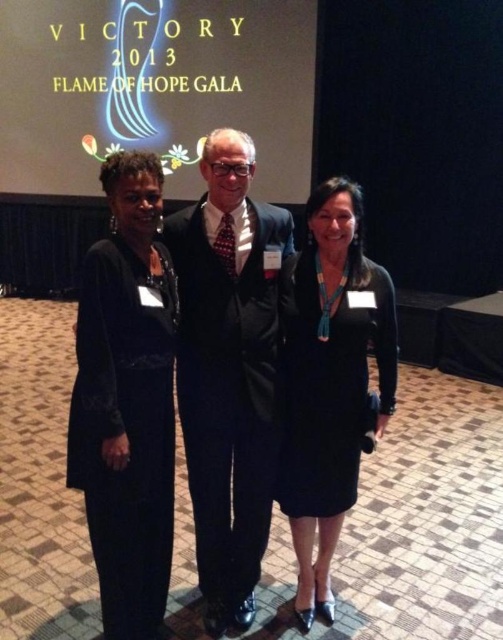
You are a photographer at the Victory 2013 Flame of Hope Gala. You need to position two individuals wearing the black textured suit at center and the black satin dress at center so that they both fit within a 1.2 meter wide frame. Can you fit them side by side without overlapping?

The black textured suit at center might be wider than black satin dress at center, so it is uncertain if they can fit side by side within the 1.2 meter frame. The photographer should check the actual width of both garments to confirm.

You are a photographer at the Victory 2013 Flame of Hope Gala. You need to adjust the camera focus to capture both the black textured suit at center and the black satin dress at left clearly. Given that the camera has a depth of field that can cover objects within 10 inches of each other, can you focus on both subjects without needing to adjust the focus distance?

The distance between the black textured suit at center and the black satin dress at left is 9.64 inches, which is within the camera depth of field range of 10 inches. Therefore, you can focus on both subjects without adjusting the focus distance.